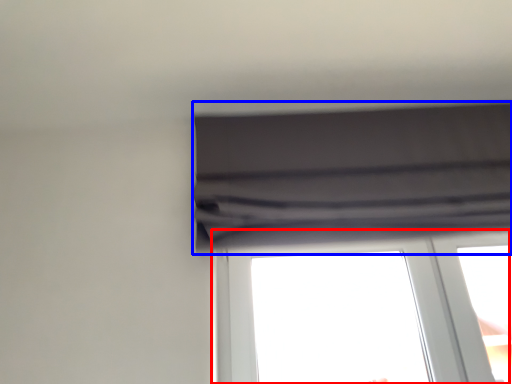
Question: Among these objects, which one is nearest to the camera, window (highlighted by a red box) or curtain (highlighted by a blue box)?

Choices:
 (A) window
 (B) curtain

Answer: (B)